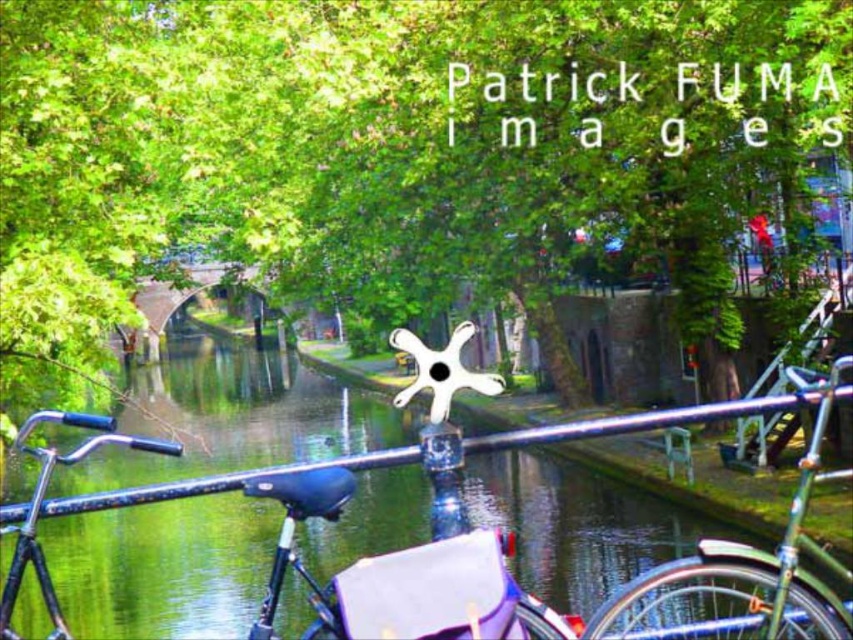
You are riding a bicycle and want to pass through a narrow canal path. You see a shiny blue bicycle at center and a green matte bicycle at center ahead. Which bicycle should you steer around first?

You should steer around the shiny blue bicycle at center first because it is closer to you than the green matte bicycle at center, which is further away.

You are riding a bicycle with a white bag and a star handlebar decoration. You see a green leafy tree at center and a green smooth water at center. Which object is larger in size?

The green leafy tree at center is bigger than the green smooth water at center, so the green leafy tree at center is larger in size.